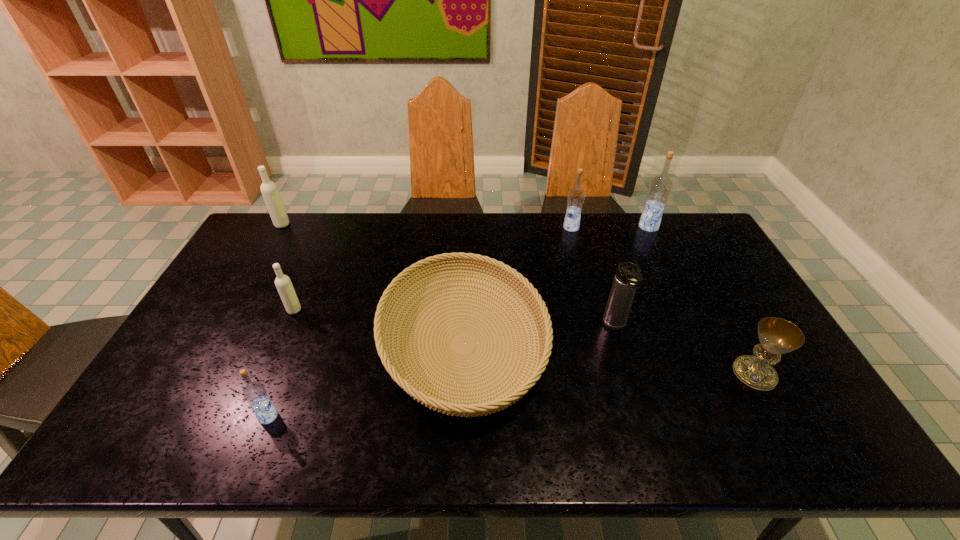
This screenshot has width=960, height=540. Find the location of `the rightmost vodka`. the rightmost vodka is located at coordinates (660, 187).

Find the location of `the second object from right to left`. the second object from right to left is located at coordinates (660, 187).

Where is `the bigger white vodka`? the bigger white vodka is located at coordinates (269, 190).

Locate an element on the screen. Image resolution: width=960 pixels, height=540 pixels. the farther white vodka is located at coordinates (269, 190).

This screenshot has height=540, width=960. What are the coordinates of `the second blue vodka from right to left` in the screenshot? It's located at (575, 199).

Locate an element on the screen. the fourth vodka from left to right is located at coordinates (575, 199).

Where is `thermos bottle`? thermos bottle is located at coordinates (627, 278).

You are a GUI agent. You are given a task and a screenshot of the screen. Output one action in this format:
    pyautogui.click(x=<x>, y=<y>)
    Task: Click on the second nearest vodka
    This screenshot has height=540, width=960.
    Given the screenshot: What is the action you would take?
    point(283,283)

Find the location of `the smaller white vodka`. the smaller white vodka is located at coordinates (283, 283).

Locate an element on the screen. the nearest blue vodka is located at coordinates (254, 392).